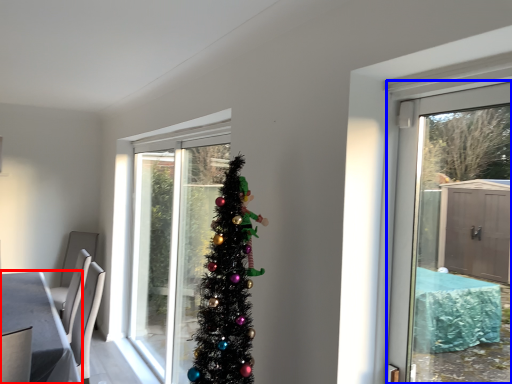
Question: Which object is further to the camera taking this photo, table (highlighted by a red box) or door (highlighted by a blue box)?

Choices:
 (A) table
 (B) door

Answer: (A)